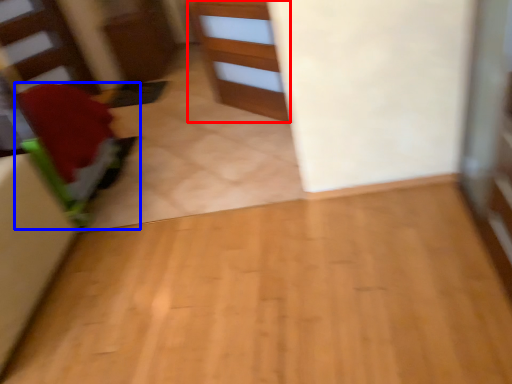
Question: Which point is closer to the camera, cabinetry (highlighted by a red box) or furniture (highlighted by a blue box)?

Choices:
 (A) cabinetry
 (B) furniture

Answer: (B)